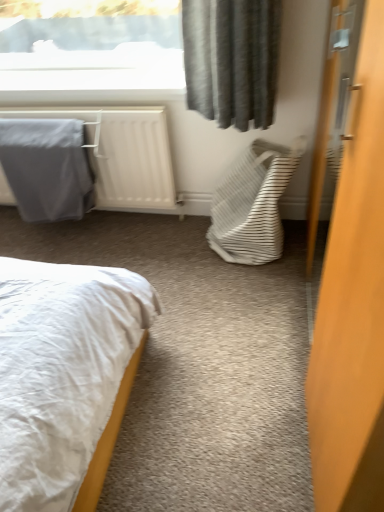
You are a GUI agent. You are given a task and a screenshot of the screen. Output one action in this format:
    pyautogui.click(x=<x>, y=<y>)
    Task: Click on the free spot to the left of white striped fabric laundry basket at center-right
    This screenshot has width=384, height=512.
    Given the screenshot: What is the action you would take?
    pyautogui.click(x=173, y=250)